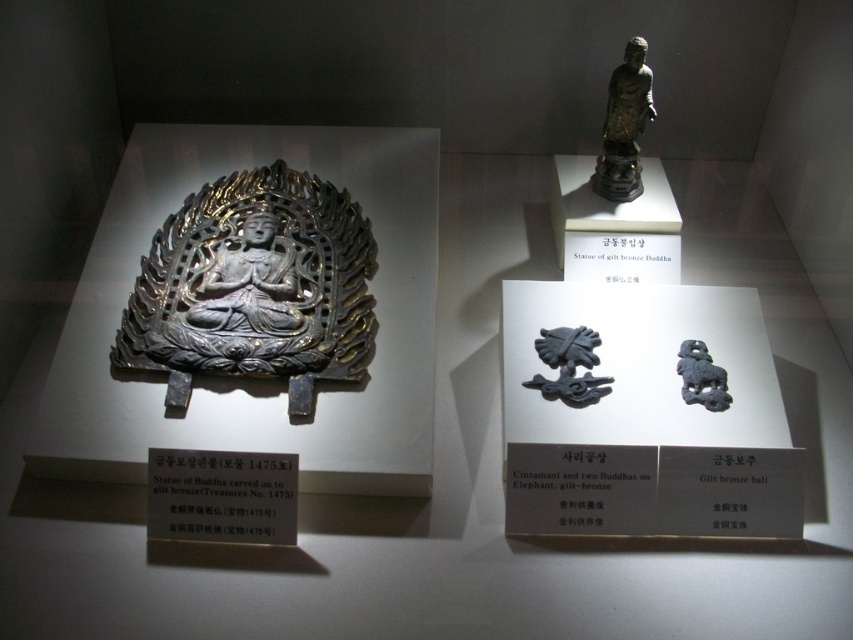
Question: Which point is closer to the camera?

Choices:
 (A) gilt bronze buddha at upper right
 (B) black matte cintamani at center

Answer: (B)

Question: Among these points, which one is nearest to the camera?

Choices:
 (A) (354, 250)
 (B) (601, 392)
 (C) (254, 253)

Answer: (B)

Question: Can you confirm if gilt-bronze buddha at center is wider than matte silver statue at center?

Choices:
 (A) no
 (B) yes

Answer: (B)

Question: Which object appears farthest from the camera in this image?

Choices:
 (A) gilt bronze plaque at center
 (B) matte silver statue at center
 (C) matte gray stone lion at center-right
 (D) gilt bronze buddha at upper right

Answer: (D)

Question: Is gilt bronze buddha at upper right smaller than matte gray stone lion at center-right?

Choices:
 (A) yes
 (B) no

Answer: (B)

Question: Does matte silver statue at center have a lesser width compared to gilt bronze buddha at upper right?

Choices:
 (A) yes
 (B) no

Answer: (B)